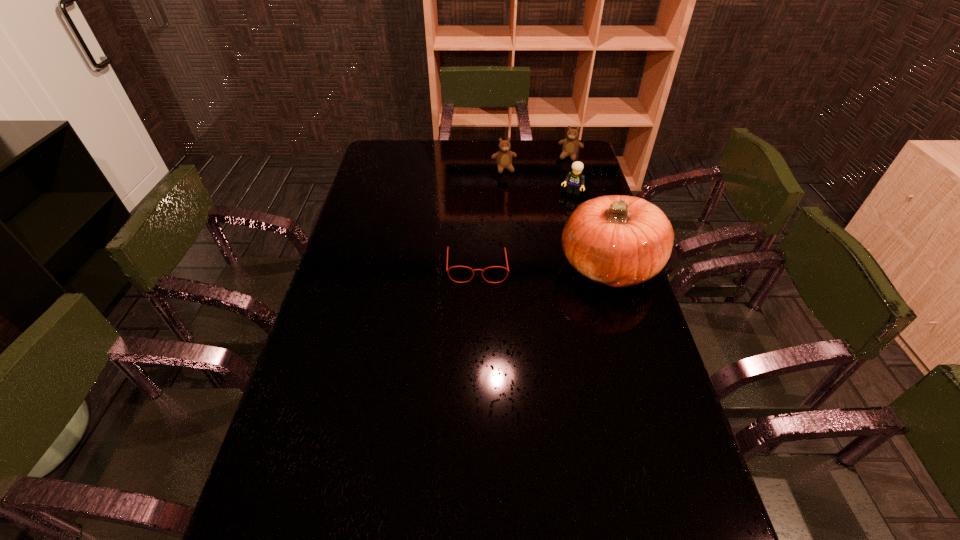
The image size is (960, 540). I want to click on Lego that is positioned at the right edge, so click(575, 178).

Find the location of a particular element. object at the far right corner is located at coordinates (570, 147).

Locate an element on the screen. The width and height of the screenshot is (960, 540). vacant space at the far edge of the desktop is located at coordinates (458, 159).

The height and width of the screenshot is (540, 960). In the image, there is a desktop. Identify the location of free space at the left edge. (305, 476).

Identify the location of free space at the right edge of the desktop. click(608, 364).

Image resolution: width=960 pixels, height=540 pixels. In order to click on free region at the near left corner of the desktop in this screenshot , I will do `click(285, 490)`.

Locate an element on the screen. Image resolution: width=960 pixels, height=540 pixels. vacant region at the far right corner of the desktop is located at coordinates (560, 158).

At what (x,y) coordinates should I click in order to perform the action: click on free space between the third farthest object and the nearer teddy bear. Please return your answer as a coordinate pair (x, y). Looking at the image, I should click on (540, 180).

Where is `free area in between the tallest object and the fourth nearest object`? The height and width of the screenshot is (540, 960). free area in between the tallest object and the fourth nearest object is located at coordinates (556, 217).

Where is `vacant space in between the spectacles and the tallest object`? The width and height of the screenshot is (960, 540). vacant space in between the spectacles and the tallest object is located at coordinates click(543, 266).